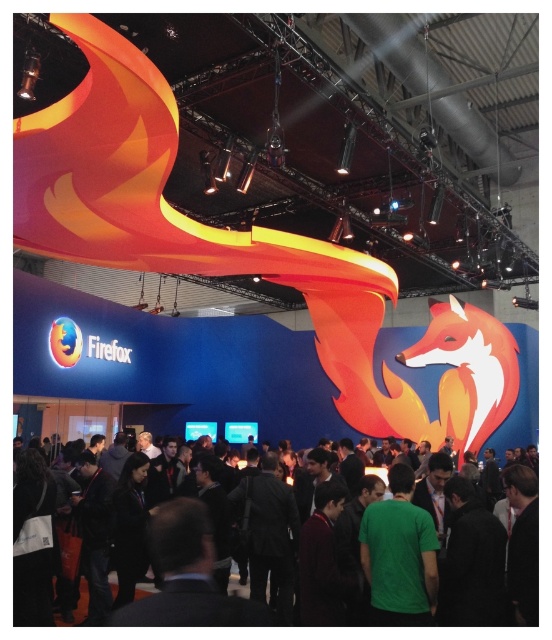
You are standing at the entrance of the event space and see two green shirts at the center of the booth area. The first is labeled as a green matte shirt at center, and the second is labeled as a green fabric shirt at center. If you want to approach both shirts to inspect their materials, which one would you reach first if you start walking straight towards the center?

Both the green matte shirt at center and the green fabric shirt at center are located at the center of the booth area, so you would reach them at the same time since they are equidistant from your starting point at the entrance.

You are standing at the entrance of the event space and notice a person wearing a green matte shirt at center. Based on their position, can you determine if they are closer to the booth or the entrance?

The green matte shirt at center is located at point (400, 556), which places them closer to the booth than the entrance.